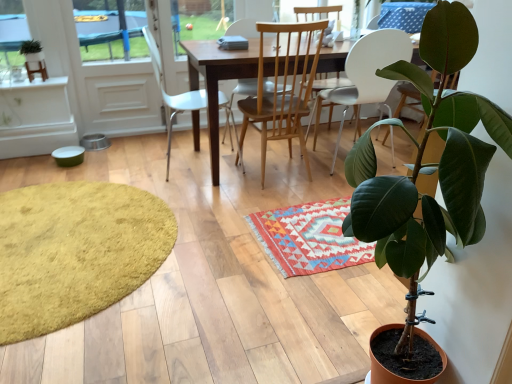
This screenshot has width=512, height=384. Identify the location of free space to the back side of multicolored woven rug at center, which appears as the 1th mat when viewed from the right. (291, 182).